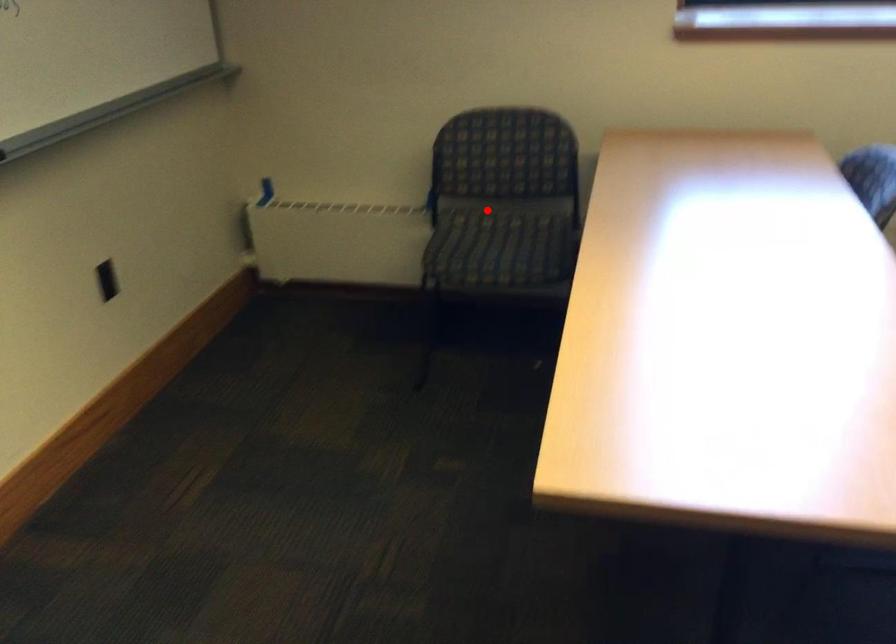
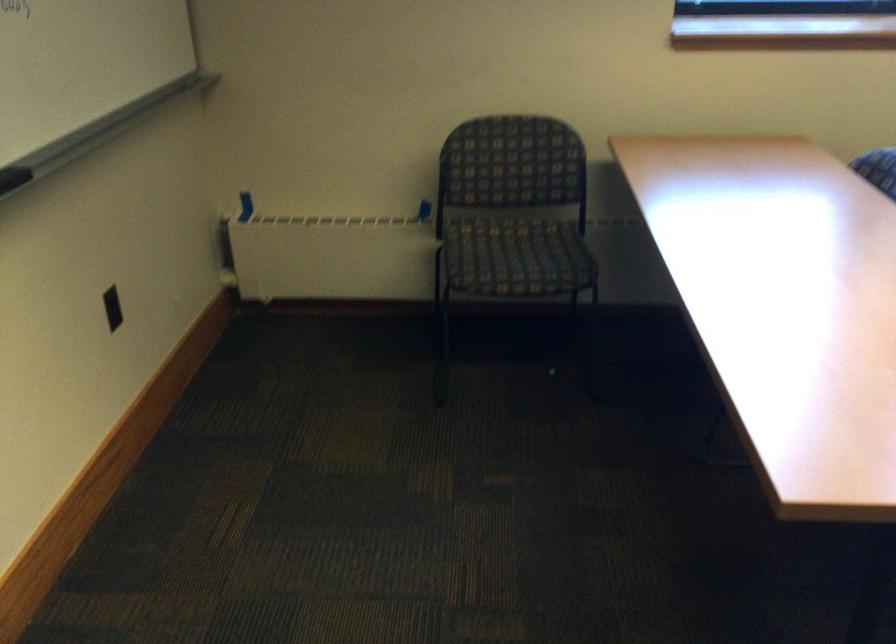
Where in the second image is the point corresponding to the highlighted location from the first image?

(488, 220)